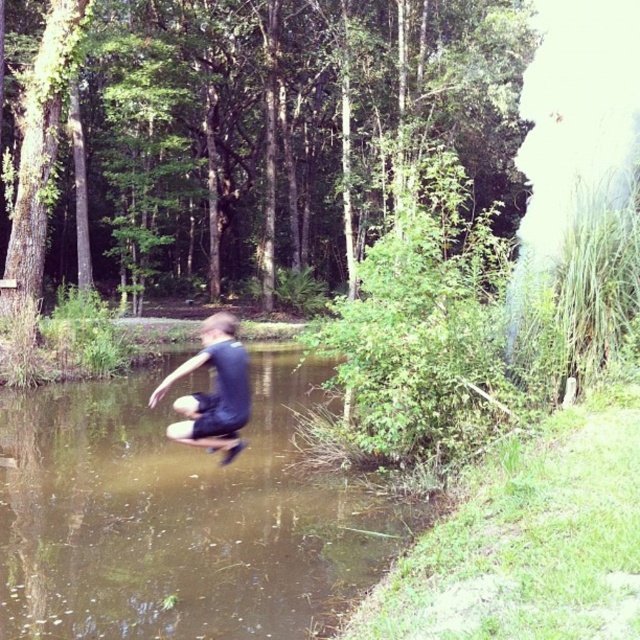
You are a safety inspector evaluating the scene. The dark blue fabric boy at center is preparing to jump into the brown murky water at center. Based on the spatial relationship between them, is the boy in a safe position to land in the water?

The brown murky water at center is positioned under the dark blue fabric boy at center, so yes, the boy is in a safe position to land in the water since the water is directly beneath him.